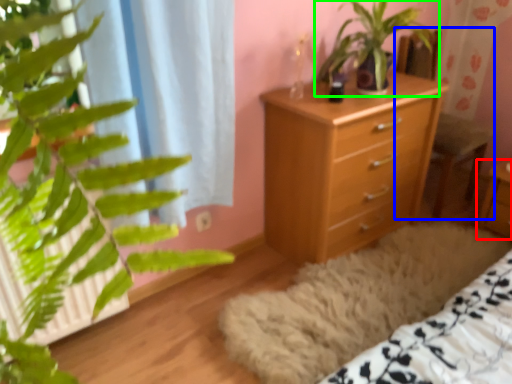
Question: Based on their relative distances, which object is nearer to nightstand (highlighted by a red box)? Choose from armchair (highlighted by a blue box) and houseplant (highlighted by a green box).

Choices:
 (A) armchair
 (B) houseplant

Answer: (A)